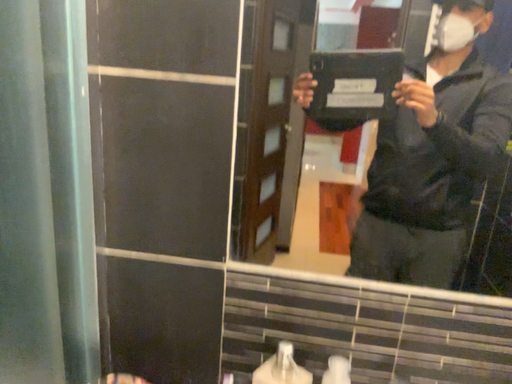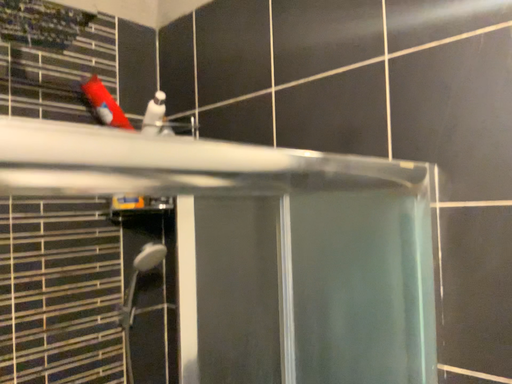
Question: How did the camera likely rotate when shooting the video?

Choices:
 (A) rotated upward
 (B) rotated downward

Answer: (A)